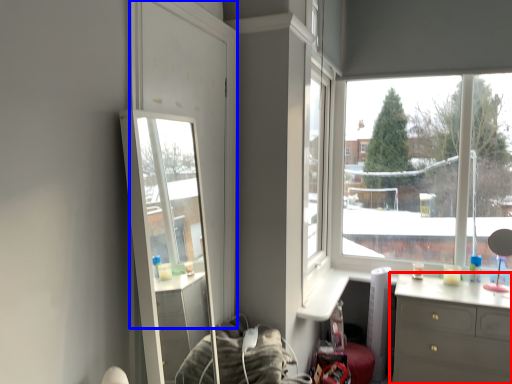
Question: Which point is closer to the camera, chest of drawers (highlighted by a red box) or glass door (highlighted by a blue box)?

Choices:
 (A) chest of drawers
 (B) glass door

Answer: (B)